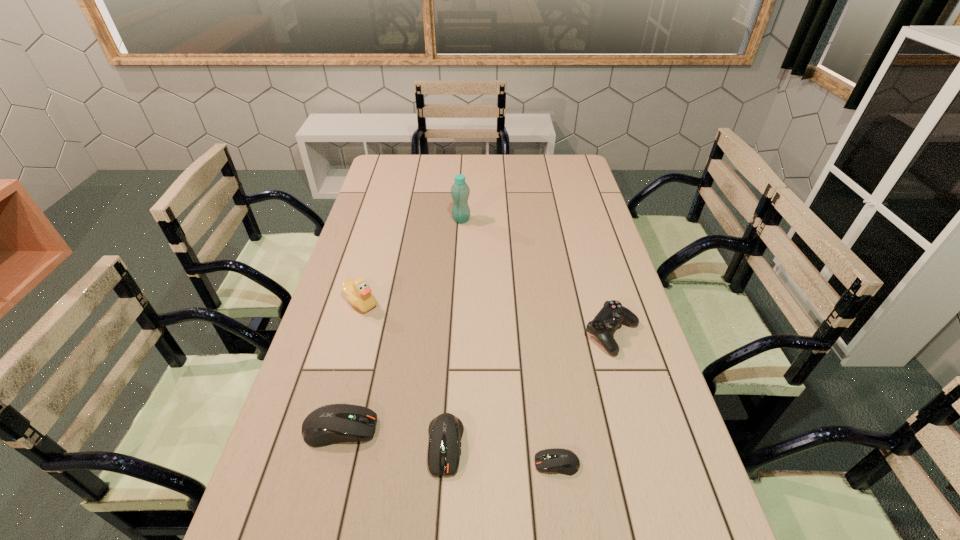
Identify the location of free space located 0.270m on the button of the leftmost computer equipment. (492, 428).

The image size is (960, 540). Find the location of `free point located 0.080m on the button of the second computer equipment from left to right`. free point located 0.080m on the button of the second computer equipment from left to right is located at coordinates (x=441, y=518).

This screenshot has width=960, height=540. In order to click on free location located on the button of the shortest object in this screenshot , I will do `click(418, 463)`.

In order to click on vacant space located on the button of the shortest object in this screenshot , I will do `click(354, 463)`.

You are a GUI agent. You are given a task and a screenshot of the screen. Output one action in this format:
    pyautogui.click(x=<x>, y=<y>)
    Task: Click on the free point located 0.270m on the button of the shortest object
    
    Given the screenshot: What is the action you would take?
    413,463

Locate an element on the screen. The height and width of the screenshot is (540, 960). blank space located at the front cap of the water bottle is located at coordinates (513, 220).

The width and height of the screenshot is (960, 540). I want to click on vacant space positioned 0.110m at the beak of the fifth shortest object, so coord(348,345).

Where is `vacant space located on the front of the third tallest object`? The height and width of the screenshot is (540, 960). vacant space located on the front of the third tallest object is located at coordinates (662, 505).

The height and width of the screenshot is (540, 960). In order to click on computer equipment that is at the left edge in this screenshot , I will do `click(330, 424)`.

This screenshot has height=540, width=960. In order to click on duck present at the left edge in this screenshot , I will do `click(359, 294)`.